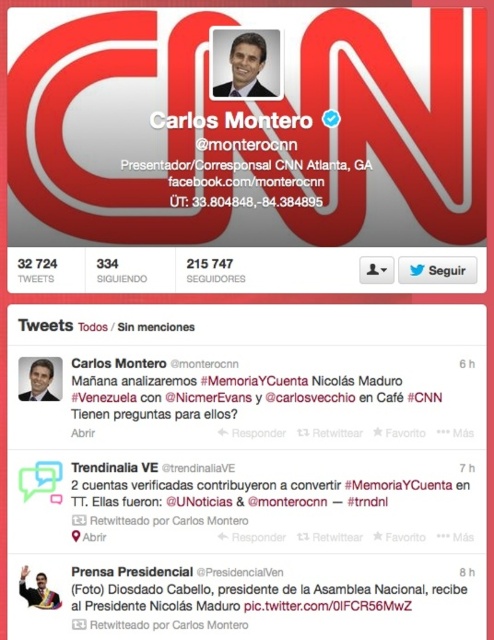
Question: Which object is farther from the camera taking this photo?

Choices:
 (A) matte black suit at upper center
 (B) white glossy logo at upper center

Answer: (A)

Question: Does white glossy logo at upper center appear on the right side of matte black suit at upper center?

Choices:
 (A) yes
 (B) no

Answer: (B)

Question: Is white glossy logo at upper center below matte black suit at upper center?

Choices:
 (A) yes
 (B) no

Answer: (A)

Question: Which of the following is the closest to the observer?

Choices:
 (A) matte black suit at upper center
 (B) white glossy logo at upper center

Answer: (B)

Question: Can you confirm if white glossy logo at upper center is positioned below matte black suit at upper center?

Choices:
 (A) no
 (B) yes

Answer: (B)